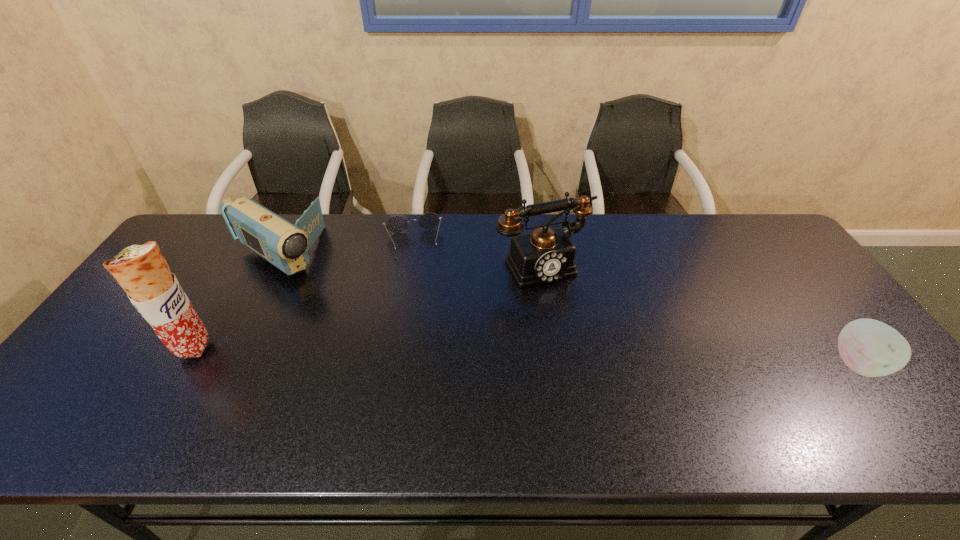
Locate an element on the screen. This screenshot has width=960, height=540. burrito is located at coordinates (141, 270).

Locate an element on the screen. This screenshot has height=540, width=960. apple is located at coordinates (871, 348).

This screenshot has width=960, height=540. I want to click on the fourth tallest object, so click(871, 348).

Image resolution: width=960 pixels, height=540 pixels. In order to click on spectacles in this screenshot , I will do `click(397, 224)`.

Where is `the shortest object`? the shortest object is located at coordinates (397, 224).

I want to click on telephone, so click(546, 255).

You are a GUI agent. You are given a task and a screenshot of the screen. Output one action in this format:
    pyautogui.click(x=<x>, y=<y>)
    Task: Click on the second object from right to left
    This screenshot has width=960, height=540.
    Given the screenshot: What is the action you would take?
    pyautogui.click(x=546, y=255)

You are a GUI agent. You are given a task and a screenshot of the screen. Output one action in this format:
    pyautogui.click(x=<x>, y=<y>)
    Task: Click on the camcorder
    
    Given the screenshot: What is the action you would take?
    pyautogui.click(x=285, y=245)

Where is `free location located 0.330m on the back of the tallest object`? This screenshot has height=540, width=960. free location located 0.330m on the back of the tallest object is located at coordinates (250, 252).

I want to click on free region located on the left of the fourth tallest object, so click(681, 363).